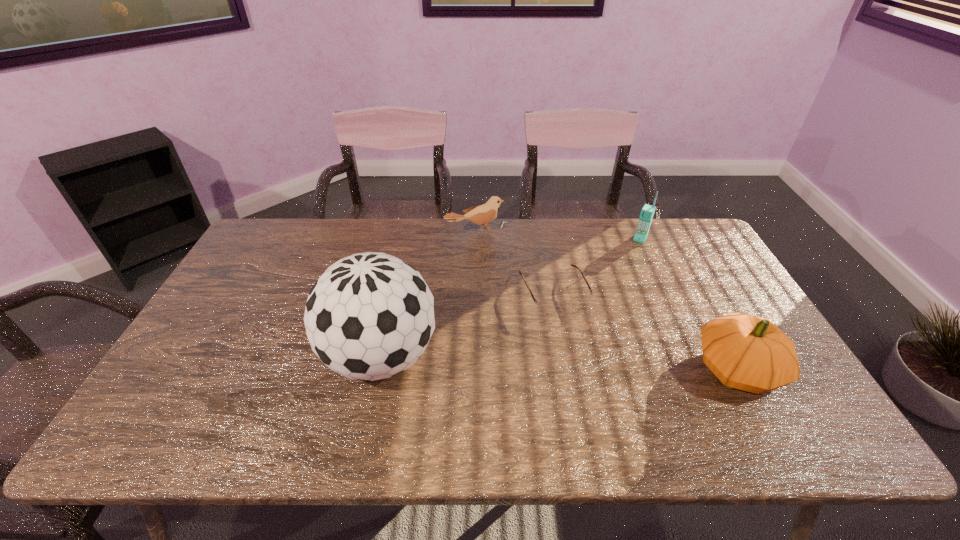
In order to click on free point that satisfies the following two spatial constraints: 1. on the front side of the shortest object; 2. on the side of the gourd with the carved face in this screenshot , I will do `click(567, 369)`.

Where is `vacant region that satisfies the following two spatial constraints: 1. on the front side of the second shortest object; 2. on the side of the gourd with the carved face`? vacant region that satisfies the following two spatial constraints: 1. on the front side of the second shortest object; 2. on the side of the gourd with the carved face is located at coordinates (475, 369).